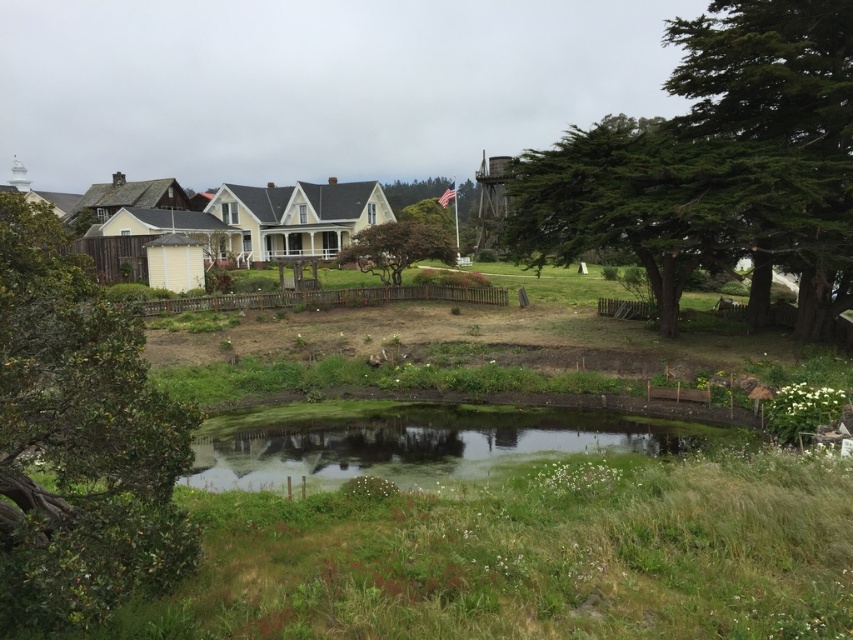
Does green textured tree at center appear on the right side of brown textured tree at center?

Yes, green textured tree at center is to the right of brown textured tree at center.

Does point (648, 147) lie behind point (352, 259)?

No, (648, 147) is closer to viewer.

Which is behind, point (608, 115) or point (416, 248)?

The point (608, 115) is behind.

Where is `green textured tree at center`? The image size is (853, 640). green textured tree at center is located at coordinates (633, 202).

Can you confirm if green textured tree at center is shorter than green grassy water at center?

Incorrect, green textured tree at center's height does not fall short of green grassy water at center's.

Is green textured tree at center further to camera compared to green grassy water at center?

Yes, it is behind green grassy water at center.

Measure the distance between green textured tree at center and camera.

green textured tree at center is 22.95 meters from camera.

This screenshot has width=853, height=640. I want to click on green textured tree at center, so click(633, 202).

This screenshot has height=640, width=853. Identify the location of green leafy tree at left. (79, 440).

In the scene shown: Can you confirm if green leafy tree at left is positioned to the right of green grassy water at center?

Incorrect, green leafy tree at left is not on the right side of green grassy water at center.

The image size is (853, 640). What do you see at coordinates (79, 440) in the screenshot?
I see `green leafy tree at left` at bounding box center [79, 440].

Image resolution: width=853 pixels, height=640 pixels. Identify the location of green leafy tree at left. (79, 440).